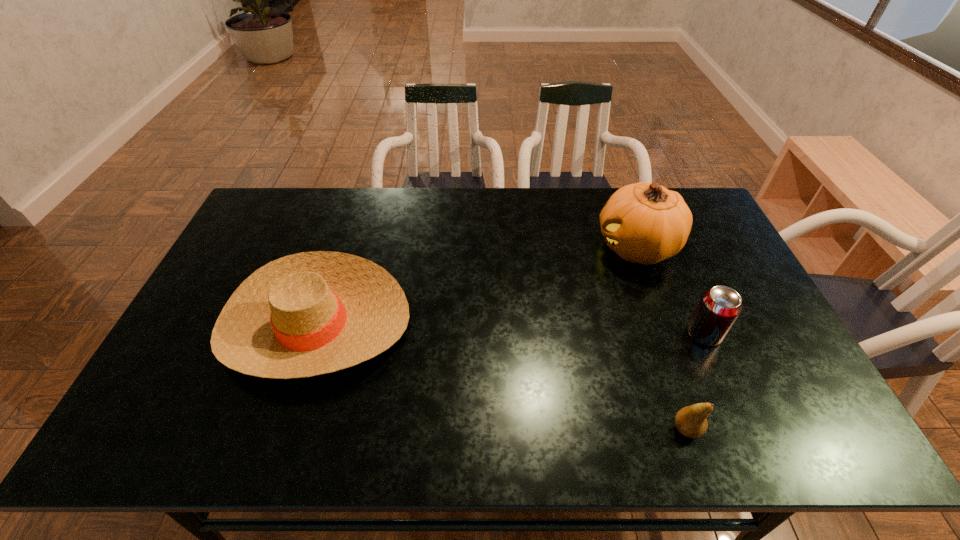
Identify the location of free region that satisfies the following two spatial constraints: 1. on the front face of the pumpkin; 2. on the back side of the soda can. (668, 334).

Locate an element on the screen. The width and height of the screenshot is (960, 540). vacant point that satisfies the following two spatial constraints: 1. on the front face of the pumpkin; 2. on the right side of the soda can is located at coordinates (668, 334).